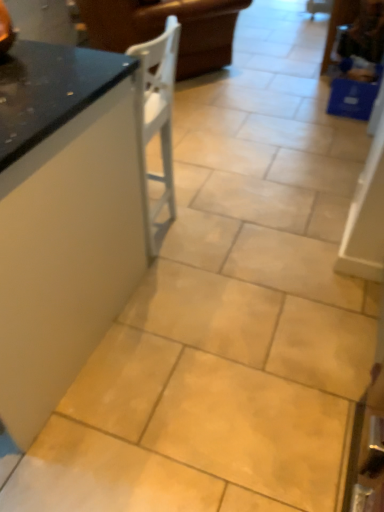
Measure the distance between white wood chair at upper left and camera.

white wood chair at upper left and camera are 9.58 feet apart from each other.

The height and width of the screenshot is (512, 384). What do you see at coordinates (163, 28) in the screenshot? I see `white wood chair at upper left` at bounding box center [163, 28].

What are the coordinates of `white wood chair at upper left` in the screenshot? It's located at (163, 28).

Describe the element at coordinates (62, 219) in the screenshot. Image resolution: width=384 pixels, height=512 pixels. I see `black glossy countertop at left` at that location.

Image resolution: width=384 pixels, height=512 pixels. I want to click on black glossy countertop at left, so click(62, 219).

Where is `white wood chair at upper left`? white wood chair at upper left is located at coordinates [163, 28].

Based on their positions, is black glossy countertop at left located to the left or right of white wood chair at upper left?

black glossy countertop at left is positioned on white wood chair at upper left's left side.

Considering the relative positions of black glossy countertop at left and white wood chair at upper left in the image provided, is black glossy countertop at left behind white wood chair at upper left?

No, black glossy countertop at left is closer to the viewer.

Which is less distant, [133,118] or [187,53]?

Point [133,118] is positioned closer to the camera compared to point [187,53].

From the image's perspective, is black glossy countertop at left on white wood chair at upper left?

Incorrect, from the image's perspective, black glossy countertop at left is lower than white wood chair at upper left.

From a real-world perspective, is black glossy countertop at left positioned above or below white wood chair at upper left?

Clearly, from a real-world perspective, black glossy countertop at left is above white wood chair at upper left.

Between black glossy countertop at left and white wood chair at upper left, which one has larger width?

With larger width is white wood chair at upper left.

Consider the image. Is black glossy countertop at left taller than white wood chair at upper left?

Yes.

Which of these two, black glossy countertop at left or white wood chair at upper left, is smaller?

With smaller size is black glossy countertop at left.

Can white wood chair at upper left be found inside black glossy countertop at left?

Actually, white wood chair at upper left is outside black glossy countertop at left.

Is black glossy countertop at left with white wood chair at upper left?

No, black glossy countertop at left is not beside white wood chair at upper left.

Does black glossy countertop at left turn towards white wood chair at upper left?

Yes, black glossy countertop at left is aimed at white wood chair at upper left.

Locate an element on the screen. This screenshot has width=384, height=512. furniture lying behind the black glossy countertop at left is located at coordinates pos(163,28).

Which is more to the left, white wood chair at upper left or black glossy countertop at left?

black glossy countertop at left is more to the left.

Which object is further away from the camera, white wood chair at upper left or black glossy countertop at left?

white wood chair at upper left is further away from the camera.

Is point (103, 13) closer or farther from the camera than point (112, 154)?

Point (103, 13) appears to be farther away from the viewer than point (112, 154).

From the image's perspective, which one is positioned lower, white wood chair at upper left or black glossy countertop at left?

black glossy countertop at left is shown below in the image.

From a real-world perspective, which is physically below, white wood chair at upper left or black glossy countertop at left?

white wood chair at upper left is physically lower.

Can you confirm if white wood chair at upper left is wider than black glossy countertop at left?

Indeed, white wood chair at upper left has a greater width compared to black glossy countertop at left.

In terms of height, does white wood chair at upper left look taller or shorter compared to black glossy countertop at left?

In the image, white wood chair at upper left appears to be shorter than black glossy countertop at left.

Considering the sizes of objects white wood chair at upper left and black glossy countertop at left in the image provided, who is smaller, white wood chair at upper left or black glossy countertop at left?

black glossy countertop at left is smaller.

Do you think white wood chair at upper left is within black glossy countertop at left, or outside of it?

white wood chair at upper left is not enclosed by black glossy countertop at left.

Looking at this image, is white wood chair at upper left next to black glossy countertop at left?

There is a gap between white wood chair at upper left and black glossy countertop at left.

Is white wood chair at upper left turned away from black glossy countertop at left?

No, white wood chair at upper left is not facing the opposite direction of black glossy countertop at left.

What are the coordinates of `furniture behind the black glossy countertop at left` in the screenshot? It's located at (163, 28).

The image size is (384, 512). Find the location of `countertop on the left of white wood chair at upper left`. countertop on the left of white wood chair at upper left is located at coordinates (62, 219).

Where is `countertop that is below the white wood chair at upper left (from the image's perspective)`? Image resolution: width=384 pixels, height=512 pixels. countertop that is below the white wood chair at upper left (from the image's perspective) is located at coordinates (62, 219).